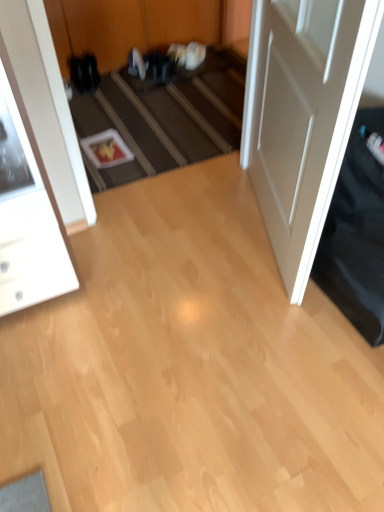
Question: Can you confirm if white glossy cabinet at left is bigger than white matte door at right?

Choices:
 (A) no
 (B) yes

Answer: (A)

Question: Can you confirm if white glossy cabinet at left is smaller than white matte door at right?

Choices:
 (A) yes
 (B) no

Answer: (A)

Question: From the image's perspective, is white glossy cabinet at left located beneath white matte door at right?

Choices:
 (A) no
 (B) yes

Answer: (B)

Question: Is white matte door at right inside white glossy cabinet at left?

Choices:
 (A) yes
 (B) no

Answer: (B)

Question: Considering the relative positions of white glossy cabinet at left and white matte door at right in the image provided, is white glossy cabinet at left in front of white matte door at right?

Choices:
 (A) no
 (B) yes

Answer: (A)

Question: Based on their positions, is white glossy cabinet at left located to the left or right of carpeted stairs at center?

Choices:
 (A) left
 (B) right

Answer: (A)

Question: In the image, is white glossy cabinet at left positioned in front of or behind carpeted stairs at center?

Choices:
 (A) front
 (B) behind

Answer: (A)

Question: Is white glossy cabinet at left situated inside carpeted stairs at center or outside?

Choices:
 (A) inside
 (B) outside

Answer: (B)

Question: Looking at their shapes, would you say white glossy cabinet at left is wider or thinner than carpeted stairs at center?

Choices:
 (A) wide
 (B) thin

Answer: (A)

Question: From a real-world perspective, relative to carpeted stairs at center, is white matte door at right vertically above or below?

Choices:
 (A) above
 (B) below

Answer: (A)

Question: In the image, is white matte door at right on the left side or the right side of carpeted stairs at center?

Choices:
 (A) left
 (B) right

Answer: (B)

Question: Is white matte door at right spatially inside carpeted stairs at center, or outside of it?

Choices:
 (A) outside
 (B) inside

Answer: (A)

Question: From the image's perspective, is white matte door at right positioned above or below carpeted stairs at center?

Choices:
 (A) below
 (B) above

Answer: (A)

Question: Looking at their shapes, would you say white glossy cabinet at left is wider or thinner than white matte door at right?

Choices:
 (A) thin
 (B) wide

Answer: (B)

Question: Is point (9, 168) positioned closer to the camera than point (281, 104)?

Choices:
 (A) closer
 (B) farther

Answer: (A)